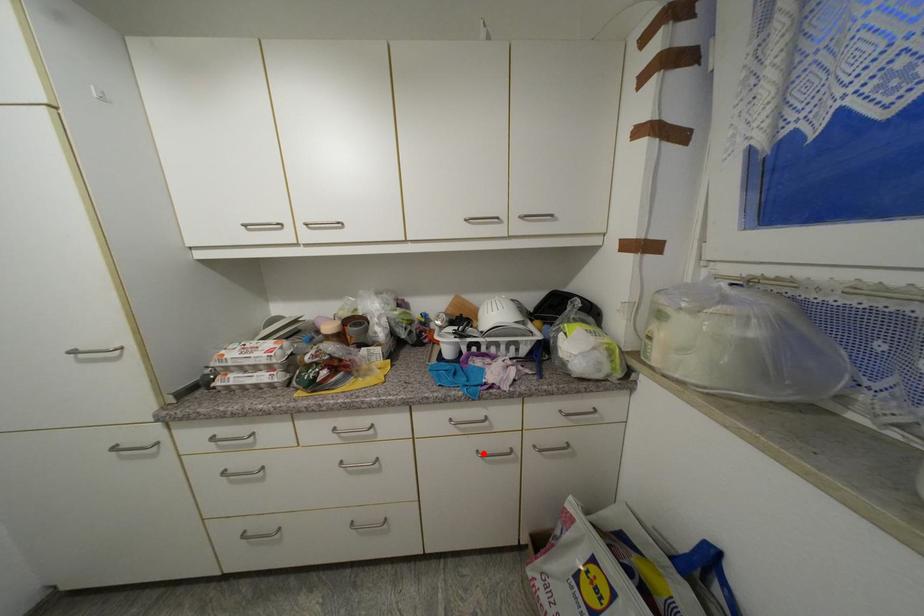
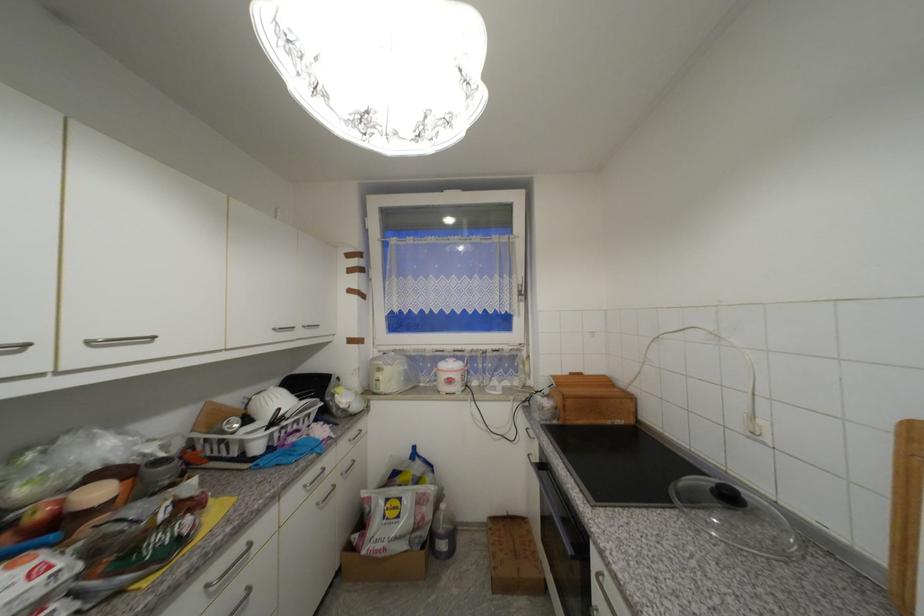
The point at the highlighted location is marked in the first image. Where is the corresponding point in the second image?

(322, 505)